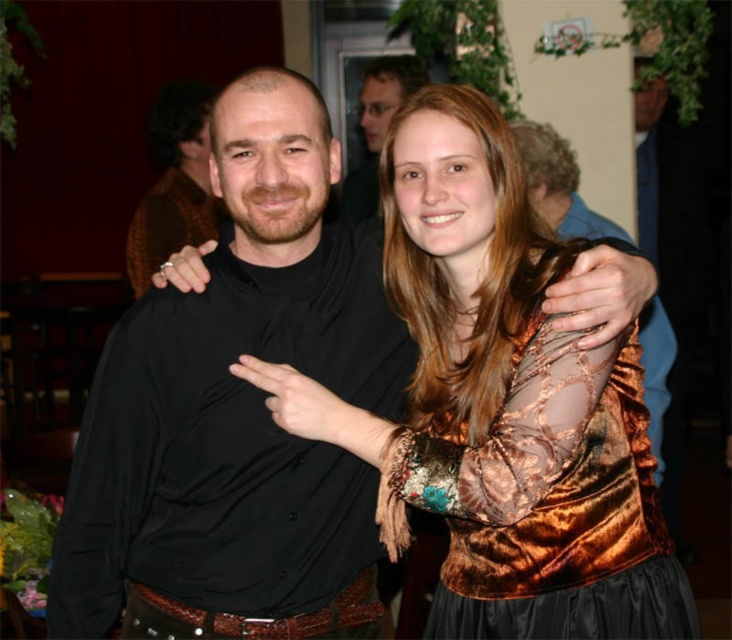
Which is below, black satin shirt at center or velvet gold dress at center?

velvet gold dress at center is lower down.

How far apart are black satin shirt at center and velvet gold dress at center?

black satin shirt at center is 25.60 centimeters away from velvet gold dress at center.

Identify the location of black satin shirt at center. (239, 410).

What do you see at coordinates (550, 504) in the screenshot? The height and width of the screenshot is (640, 732). I see `velvet gold dress at upper right` at bounding box center [550, 504].

Which of these two, velvet gold dress at upper right or matte black shirt at upper center, stands taller?

With more height is matte black shirt at upper center.

Does point (591, 374) come behind point (373, 161)?

No, it is in front of (373, 161).

The height and width of the screenshot is (640, 732). What are the coordinates of `velvet gold dress at upper right` in the screenshot? It's located at (550, 504).

Is black satin shirt at center shorter than matte black shirt at upper center?

Incorrect, black satin shirt at center's height does not fall short of matte black shirt at upper center's.

Does black satin shirt at center appear under matte black shirt at upper center?

Correct, black satin shirt at center is located below matte black shirt at upper center.

Identify the location of black satin shirt at center. This screenshot has height=640, width=732. (239, 410).